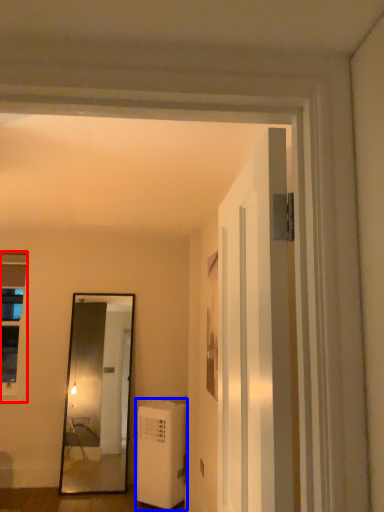
Question: Among these objects, which one is nearest to the camera, window (highlighted by a red box) or air conditioner (highlighted by a blue box)?

Choices:
 (A) window
 (B) air conditioner

Answer: (B)